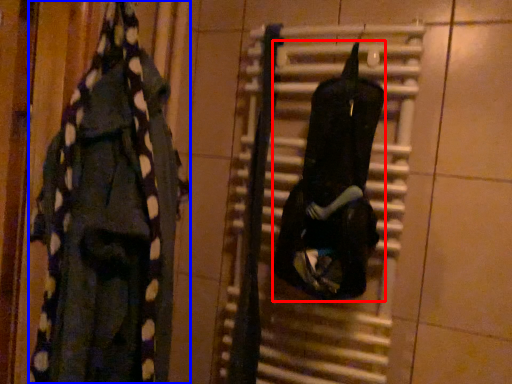
Question: Among these objects, which one is nearest to the camera, clothing (highlighted by a red box) or clothing (highlighted by a blue box)?

Choices:
 (A) clothing
 (B) clothing

Answer: (B)